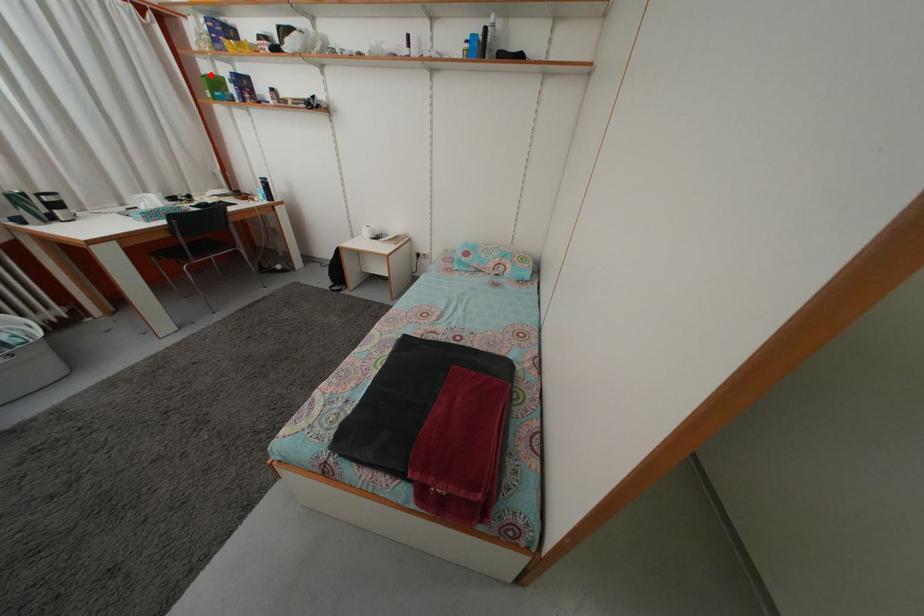
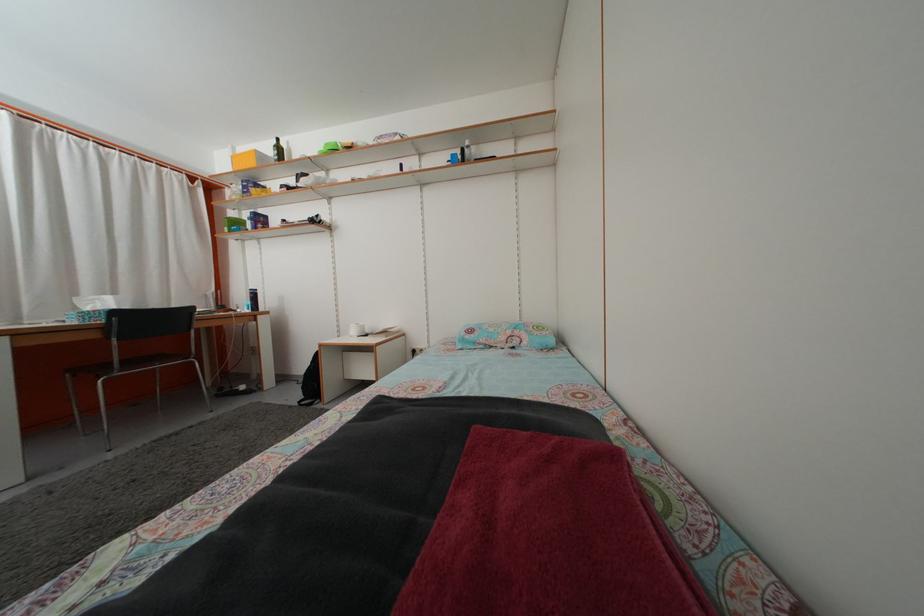
Question: I am providing you with two images of the same scene from different viewpoints. A red point is shown in image1. For the corresponding object point in image2, is it positioned nearer or farther from the camera?

Choices:
 (A) Nearer
 (B) Farther

Answer: (A)